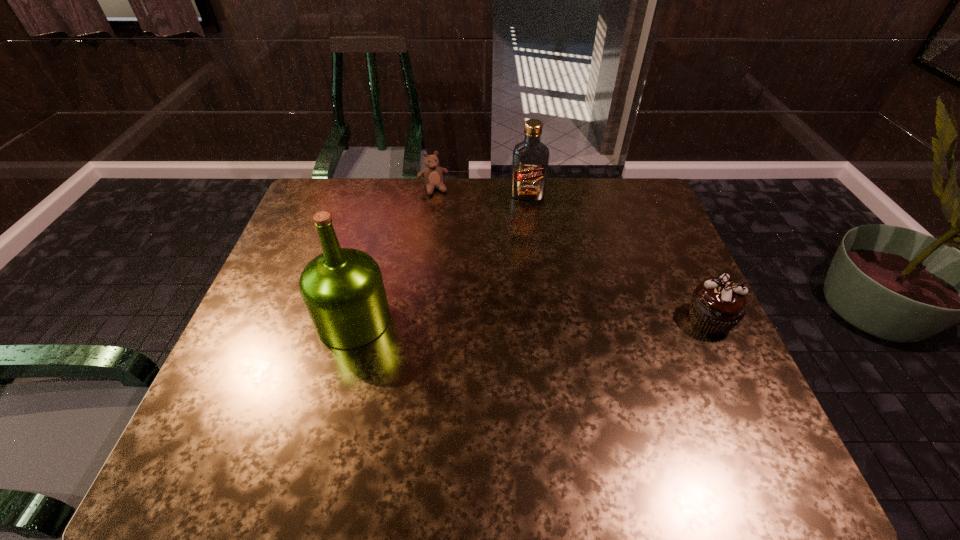
I want to click on blank area at the left edge, so click(346, 232).

In the image, there is a desktop. Identify the location of vacant space at the right edge. (654, 280).

The width and height of the screenshot is (960, 540). Identify the location of blank space at the far left corner of the desktop. (302, 216).

I want to click on vacant space at the far right corner of the desktop, so click(604, 185).

Where is `vacant area at the near right corner`? The height and width of the screenshot is (540, 960). vacant area at the near right corner is located at coordinates (718, 418).

You are a GUI agent. You are given a task and a screenshot of the screen. Output one action in this format:
    pyautogui.click(x=<x>, y=<y>)
    Task: Click on the free area in between the vodka and the teddy bear
    
    Given the screenshot: What is the action you would take?
    pyautogui.click(x=480, y=192)

Identify the location of free spot between the second tallest object and the cupcake. The height and width of the screenshot is (540, 960). (618, 258).

What are the coordinates of `free point between the second object from left to right and the third object from left to right` in the screenshot? It's located at (480, 192).

Find the location of a particular element. This screenshot has height=540, width=960. free space between the leftmost object and the vodka is located at coordinates tap(441, 258).

You are a GUI agent. You are given a task and a screenshot of the screen. Output one action in this format:
    pyautogui.click(x=<x>, y=<y>)
    Task: Click on the free space between the rightmost object and the vodka
    
    Given the screenshot: What is the action you would take?
    pyautogui.click(x=618, y=258)